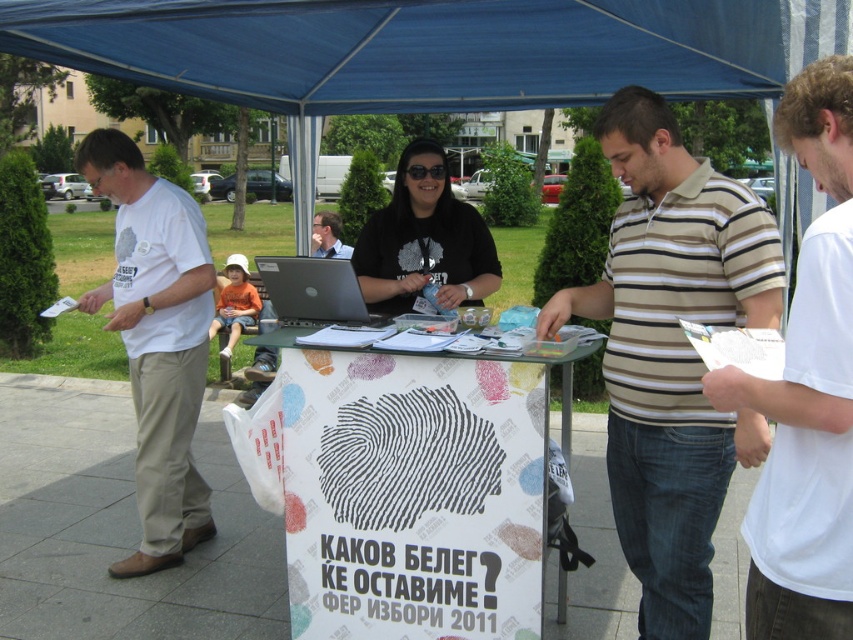
Is point (370, 481) positioned before point (231, 300)?

Yes, it is.

The width and height of the screenshot is (853, 640). Describe the element at coordinates (415, 490) in the screenshot. I see `white plastic table at center` at that location.

The height and width of the screenshot is (640, 853). Find the location of `white plastic table at center`. white plastic table at center is located at coordinates (415, 490).

Does black matte shirt at center have a greater width compared to silver metallic laptop at center?

Indeed, black matte shirt at center has a greater width compared to silver metallic laptop at center.

Is black matte shirt at center further to camera compared to silver metallic laptop at center?

That is True.

Is point (366, 248) closer to viewer compared to point (368, 323)?

No, it is behind (368, 323).

Image resolution: width=853 pixels, height=640 pixels. Find the location of `black matte shirt at center`. black matte shirt at center is located at coordinates (424, 241).

Identify the location of striped polo shirt at center. (671, 352).

This screenshot has height=640, width=853. What do you see at coordinates (671, 352) in the screenshot?
I see `striped polo shirt at center` at bounding box center [671, 352].

Identify the location of striped polo shirt at center. Image resolution: width=853 pixels, height=640 pixels. (671, 352).